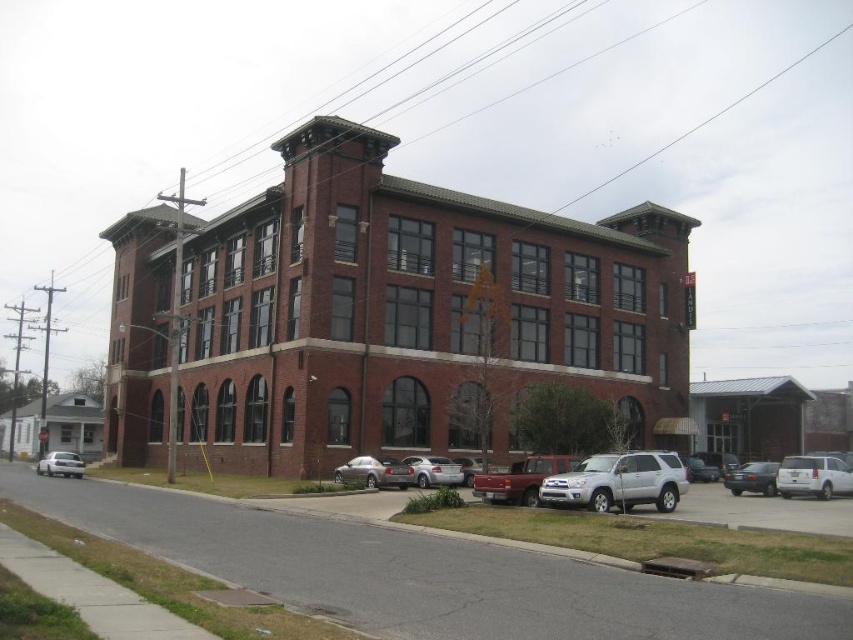
You are a delivery driver who needs to park your truck in the parking area near the building. You see a metallic gray sedan at lower right and a white matte sedan at lower left. Which vehicle should you avoid parking next to if you want to leave first?

You should avoid parking next to the metallic gray sedan at lower right because it is smaller than the white matte sedan at lower left, so it might be easier to maneuver around the larger vehicle when leaving.

You are standing on the sidewalk in front of the three story brick building and want to cross the street to reach the parking area. The metallic gray sedan at lower right is blocking your path. Can you walk around it on the left side without entering the street?

The metallic gray sedan at lower right is located at point (752,477). Since the sedan is parked along the curb, you can walk around it on the left side while staying on the sidewalk to reach the parking area.

You are a delivery person needing to park your white matte sedan at lower left in a space that can only accommodate vehicles narrower than 1.8 meters. Based on the scene, can you determine if your sedan will fit in the parking space reserved for the metallic gray sedan at lower right?

The metallic gray sedan at lower right is narrower than the white matte sedan at lower left. Since the parking space is reserved for the metallic gray sedan at lower right, which is narrower, the white matte sedan at lower left may not fit in that space.